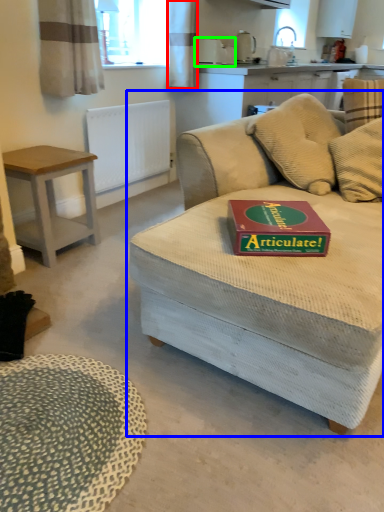
Question: Considering the real-world distances, which object is farthest from curtain (highlighted by a red box)? studio couch (highlighted by a blue box) or appliance (highlighted by a green box)?

Choices:
 (A) studio couch
 (B) appliance

Answer: (A)